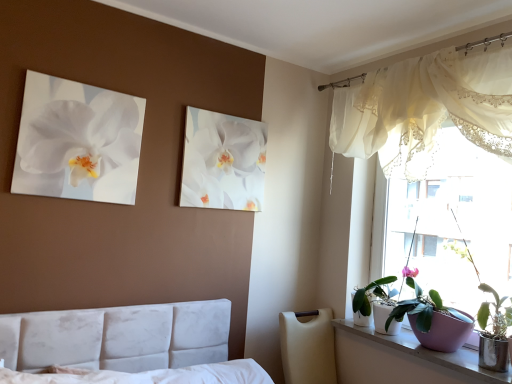
Question: Considering the positions of purple ceramic pot at window, which appears as the first houseplant when viewed from the front, and white glossy orchid at upper center, the second flower when ordered from left to right, in the image, is purple ceramic pot at window, which appears as the first houseplant when viewed from the front, taller or shorter than white glossy orchid at upper center, the second flower when ordered from left to right,?

Choices:
 (A) tall
 (B) short

Answer: (A)

Question: Is purple ceramic pot at window, which appears as the first houseplant when viewed from the front, wider or thinner than white glossy orchid at upper center, which appears as the 2th flower when viewed from the front?

Choices:
 (A) thin
 (B) wide

Answer: (B)

Question: Which of these objects is positioned closest to the purple ceramic pot at window, which is counted as the second houseplant, starting from the front?

Choices:
 (A) sheer white curtain at upper right
 (B) translucent fabric at upper right
 (C) white glossy pot at window, the third houseplant in the front-to-back sequence
 (D) white glossy orchid at upper center, the 1th flower when ordered from right to left
 (E) white glossy orchid at upper left, the second flower viewed from the back

Answer: (C)

Question: Which object is the farthest from the white glossy pot at window, arranged as the first houseplant when viewed from the back?

Choices:
 (A) purple ceramic pot at window, which appears as the first houseplant when viewed from the front
 (B) sheer white curtain at upper right
 (C) translucent fabric at upper right
 (D) purple ceramic pot at window, which is counted as the second houseplant, starting from the front
 (E) white glossy orchid at upper left, the second flower viewed from the back

Answer: (E)